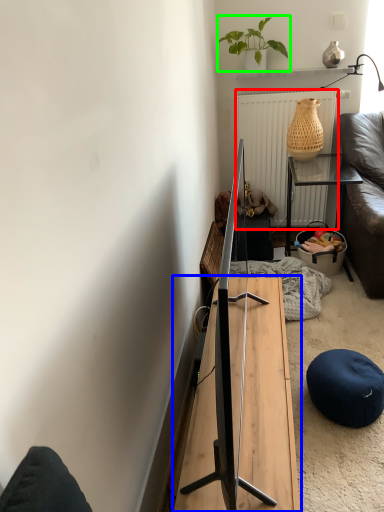
Question: Which object is the farthest from radiator (highlighted by a red box)? Choose among these: table (highlighted by a blue box) or houseplant (highlighted by a green box).

Choices:
 (A) table
 (B) houseplant

Answer: (A)